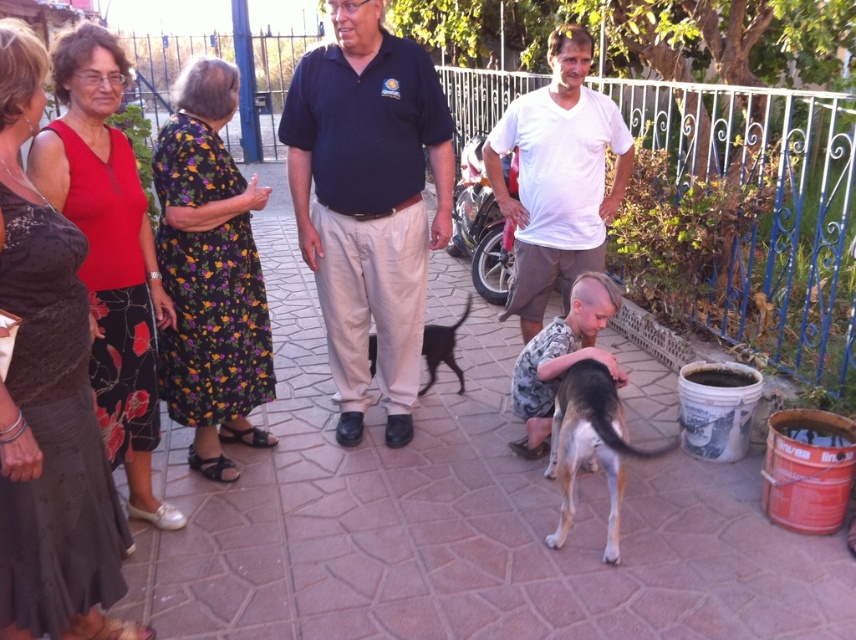
You are a photographer trying to capture a photo of the white cotton shirt at center and the black fur dog at center. If you want to ensure both subjects are in focus, which one should you focus on first considering their heights?

The white cotton shirt at center is taller than the black fur dog at center, so you should focus on the white cotton shirt at center first to ensure both are in focus.

You are standing in the courtyard and want to take a photo of the white cotton shirt at center. Where should you position yourself to capture it in the frame?

You should position yourself at a point where the white cotton shirt at center is visible. Since it is located at coordinates point (557, 177), you can aim your camera towards that specific coordinate to capture it.